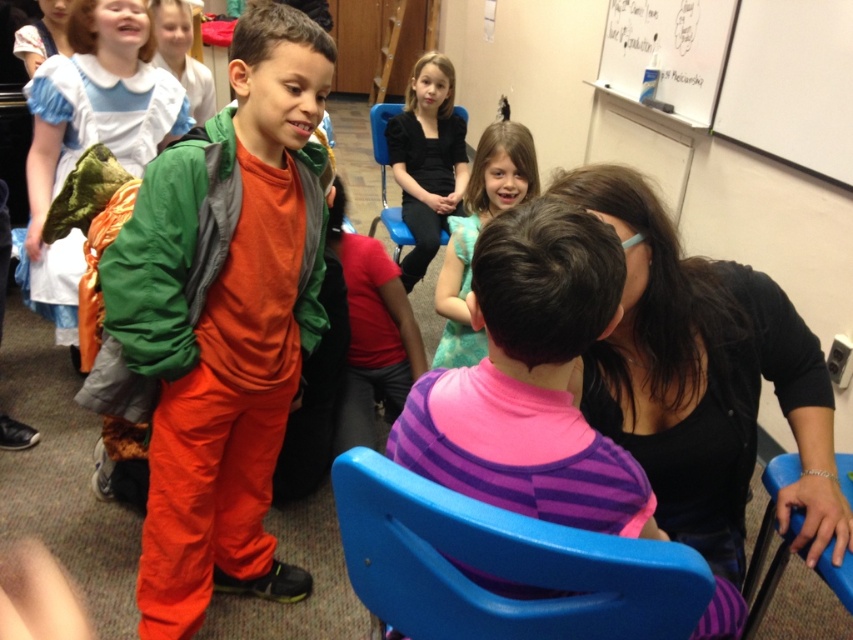
Question: Which point appears closest to the camera in this image?

Choices:
 (A) click(792, 528)
 (B) click(372, 118)
 (C) click(845, 8)
 (D) click(554, 586)

Answer: (D)

Question: Is matte green jacket at center bigger than blue plastic chair at lower right?

Choices:
 (A) yes
 (B) no

Answer: (A)

Question: Which is farther from the blue plastic chair at lower right?

Choices:
 (A) matte green jacket at center
 (B) black matte shirt at center

Answer: (A)

Question: Does matte green jacket at center have a smaller size compared to white matte board at upper right?

Choices:
 (A) yes
 (B) no

Answer: (B)

Question: Does matte green jacket at center have a lesser width compared to black matte shirt at center?

Choices:
 (A) no
 (B) yes

Answer: (B)

Question: Which of the following is the closest to the observer?

Choices:
 (A) (372, 120)
 (B) (515, 150)
 (C) (780, 570)

Answer: (C)